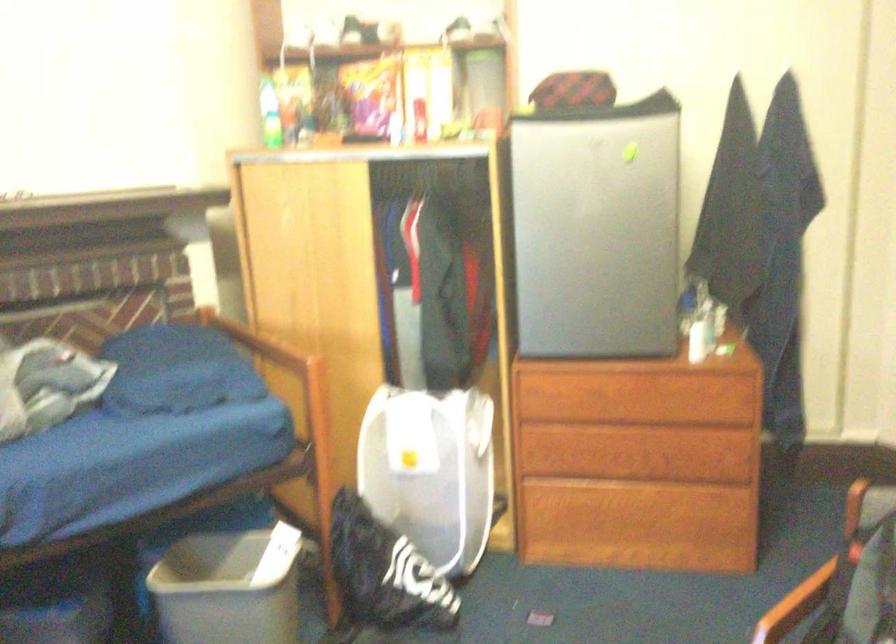
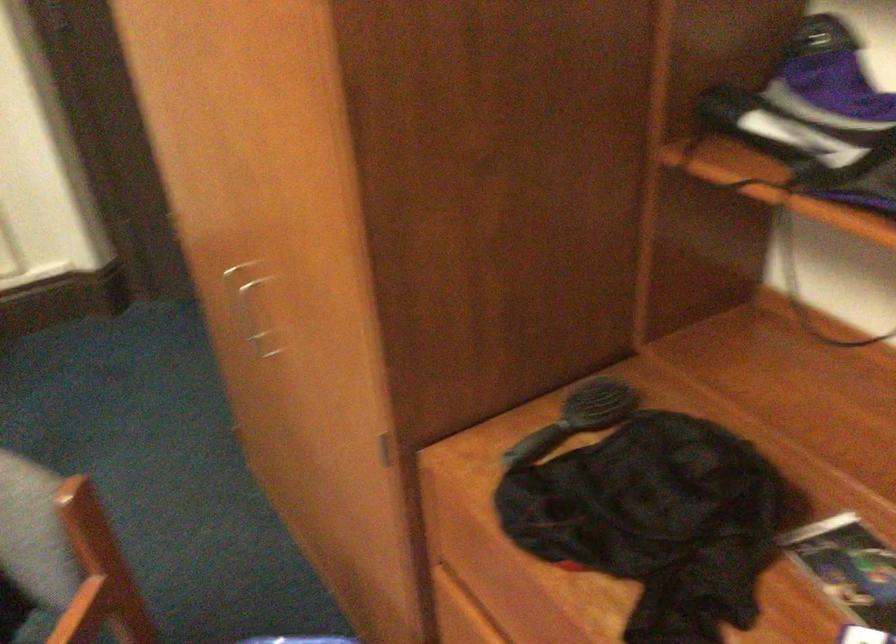
The images are taken continuously from a first-person perspective. In which direction is your viewpoint rotating?

The rotation direction of the camera is right-down.